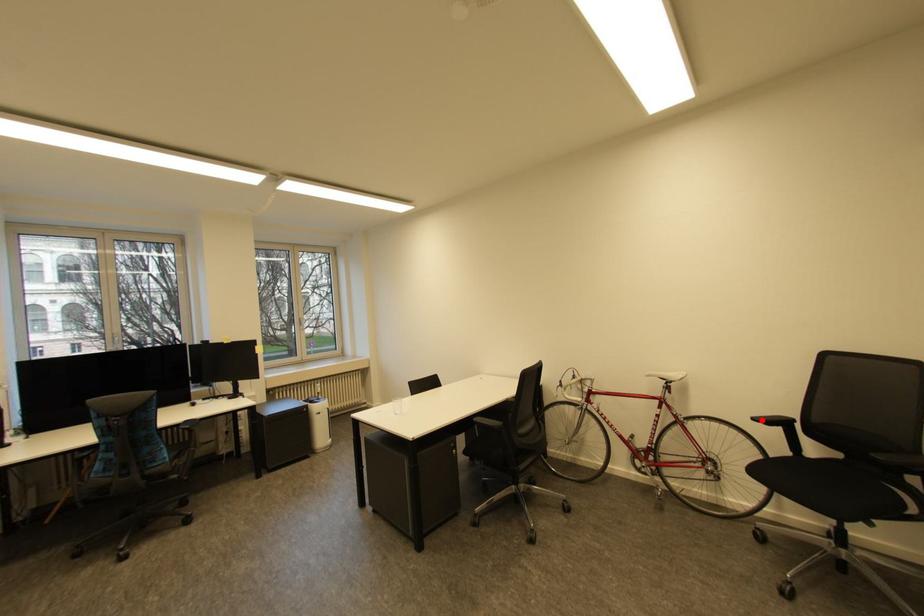
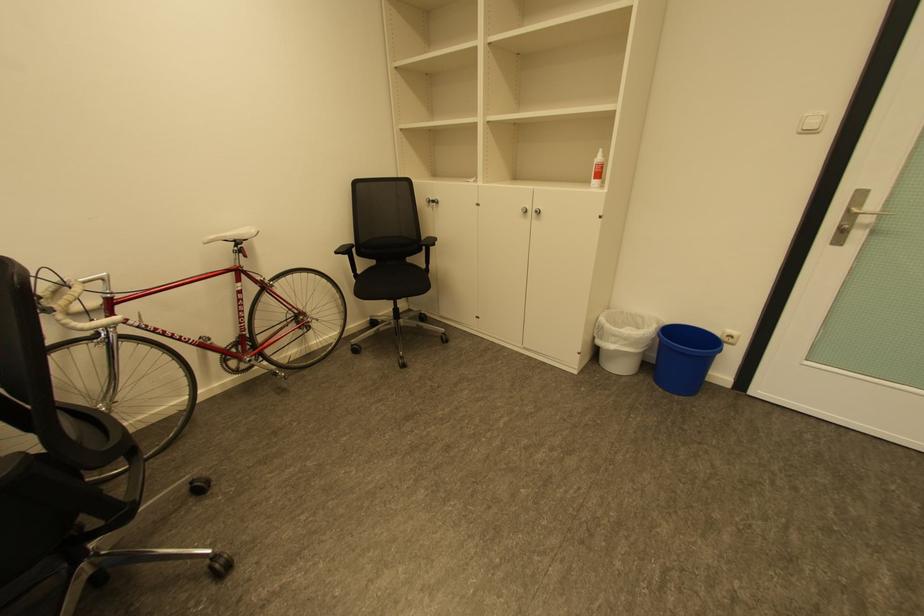
Question: I am providing you with two images of the same scene from different viewpoints. Image1 has a red point marked. In image2, the corresponding 3D location appears at what relative position? Reply with the corresponding letter.

Choices:
 (A) Closer
 (B) Farther

Answer: (A)